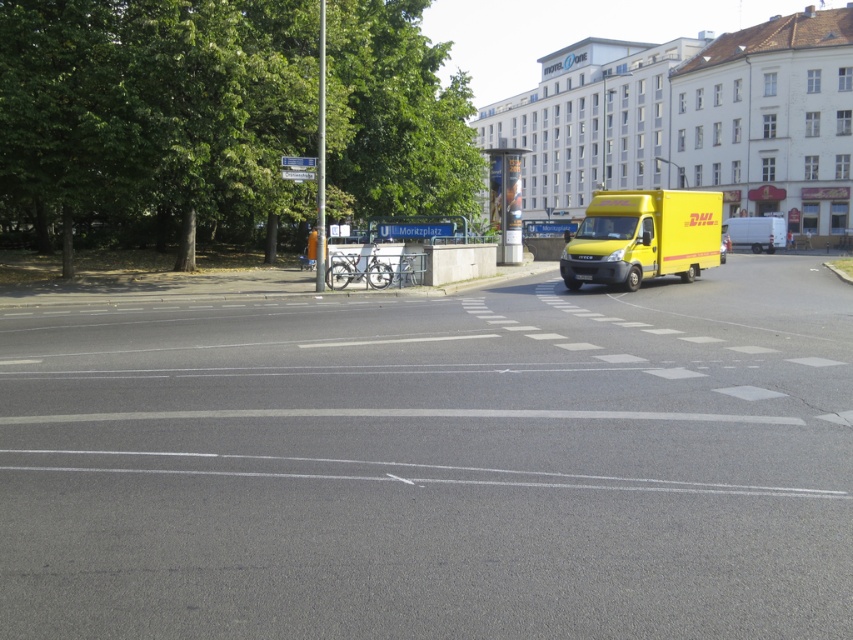
Does point (305, 67) come in front of point (587, 224)?

No, (305, 67) is further to viewer.

Who is positioned more to the left, green leafy tree at upper left or yellow matte van at center?

From the viewer's perspective, green leafy tree at upper left appears more on the left side.

Which is behind, point (36, 4) or point (611, 282)?

Point (611, 282)

I want to click on green leafy tree at upper left, so click(x=154, y=108).

Is yellow matte van at center wider than yellow rubber van at right?

Yes.

How distant is yellow matte van at center from yellow rubber van at right?

yellow matte van at center and yellow rubber van at right are 44.11 meters apart from each other.

At what (x,y) coordinates should I click in order to perform the action: click on yellow matte van at center. Please return your answer as a coordinate pair (x, y). Looking at the image, I should click on (643, 236).

Looking at this image, does green leafy tree at upper left have a smaller size compared to yellow rubber van at right?

Incorrect, green leafy tree at upper left is not smaller in size than yellow rubber van at right.

Consider the image. Which is below, green leafy tree at upper left or yellow rubber van at right?

Positioned lower is yellow rubber van at right.

Is point (12, 13) less distant than point (738, 220)?

Yes.

Locate an element on the screen. green leafy tree at upper left is located at coordinates (154, 108).